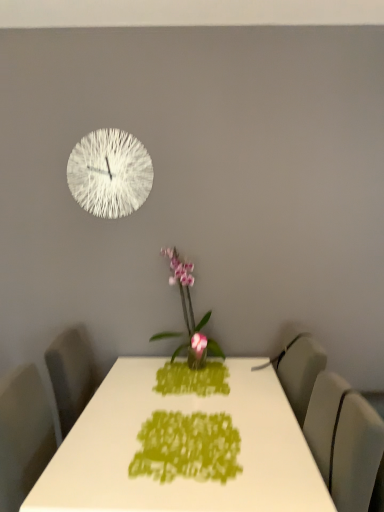
Question: Is matte gray swivel chair at right in front of or behind white glossy table at center in the image?

Choices:
 (A) front
 (B) behind

Answer: (B)

Question: From their relative heights in the image, would you say matte gray swivel chair at right is taller or shorter than white glossy table at center?

Choices:
 (A) short
 (B) tall

Answer: (A)

Question: Which of these objects is positioned farthest from the white glossy table at center?

Choices:
 (A) matte gray swivel chair at right
 (B) white textured clock at upper left
 (C) green fabric placemat at center
 (D) pink glossy orchid at center

Answer: (B)

Question: Which is nearer to the white textured clock at upper left?

Choices:
 (A) white glossy table at center
 (B) matte gray swivel chair at right
 (C) green fabric placemat at center
 (D) pink glossy orchid at center

Answer: (D)